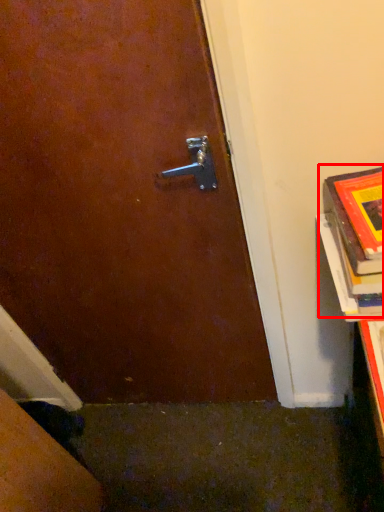
Question: From the image's perspective, what is the correct spatial relationship of book (annotated by the red box) in relation to book cover?

Choices:
 (A) above
 (B) below

Answer: (A)